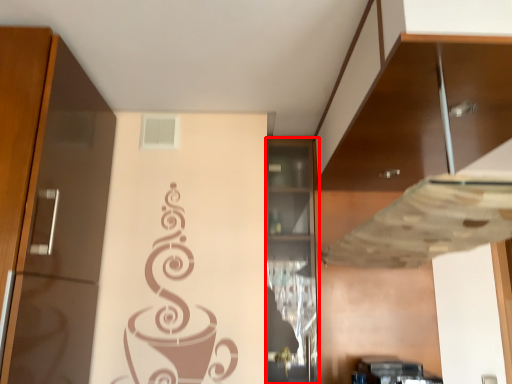
Question: From the image's perspective, where is cabinetry (annotated by the red box) located in relation to cabinetry in the image?

Choices:
 (A) above
 (B) below

Answer: (B)